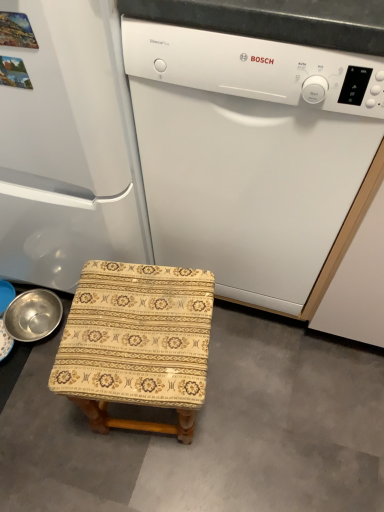
Where is `free space to the right of patterned fabric stool at center`? free space to the right of patterned fabric stool at center is located at coordinates (251, 395).